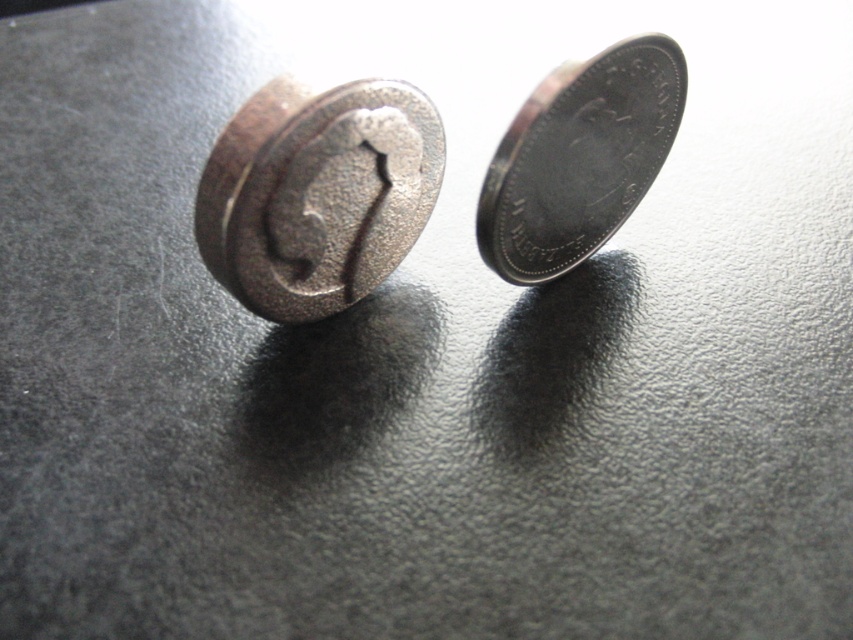
Question: Among these objects, which one is nearest to the camera?

Choices:
 (A) rusty metal coin at center
 (B) silver metallic coin at upper right

Answer: (A)

Question: Does rusty metal coin at center appear under silver metallic coin at upper right?

Choices:
 (A) no
 (B) yes

Answer: (B)

Question: Does rusty metal coin at center come behind silver metallic coin at upper right?

Choices:
 (A) no
 (B) yes

Answer: (A)

Question: Is rusty metal coin at center smaller than silver metallic coin at upper right?

Choices:
 (A) no
 (B) yes

Answer: (A)

Question: Among these objects, which one is nearest to the camera?

Choices:
 (A) silver metallic coin at upper right
 (B) rusty metal coin at center

Answer: (B)